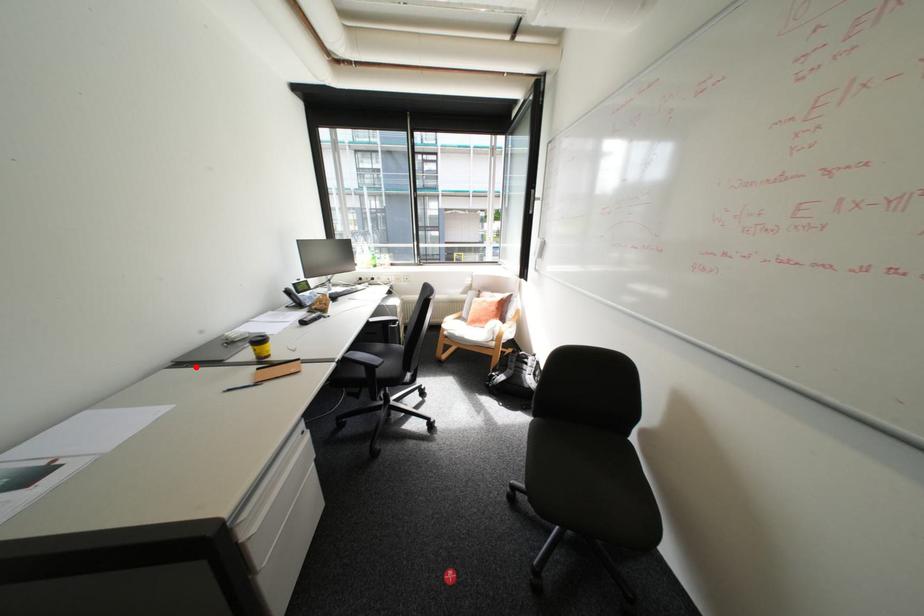
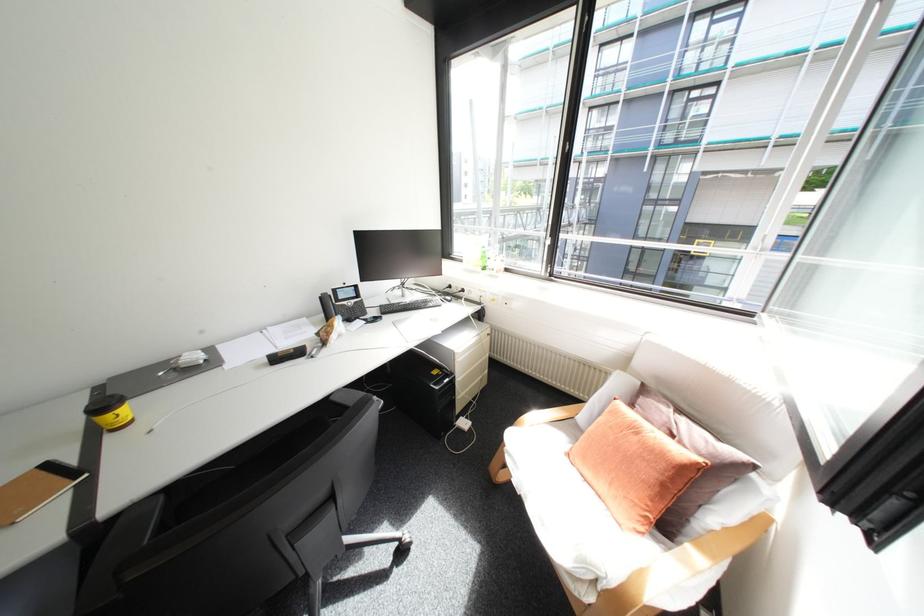
Locate, in the second image, the point that corresponds to the highlighted location in the first image.

(103, 397)